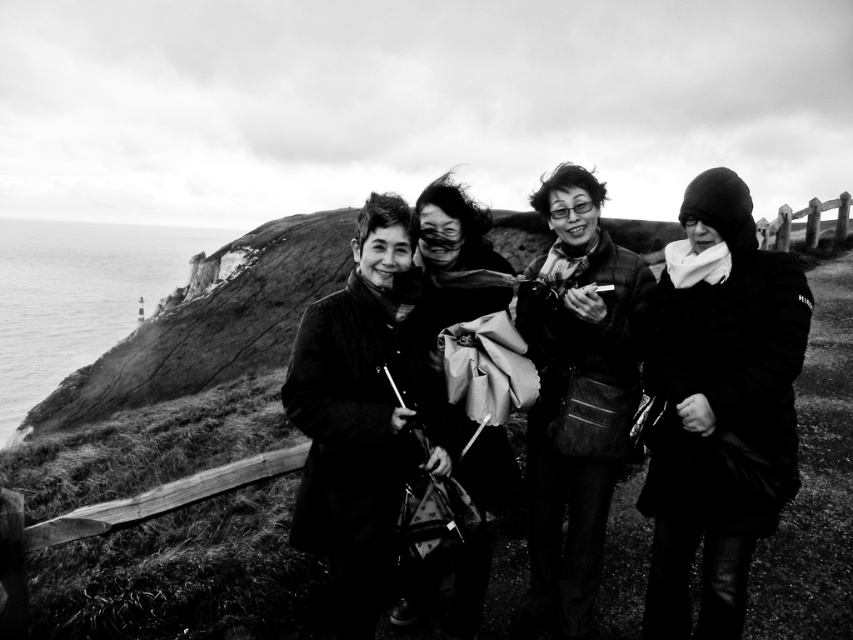
Question: Which object is positioned closest to the black woolen coat at right?

Choices:
 (A) matte black jacket at center
 (B) velvet black coat at center

Answer: (A)

Question: Estimate the real-world distances between objects in this image. Which object is closer to the matte black scarf at center?

Choices:
 (A) matte black jacket at center
 (B) black woolen coat at right
 (C) velvet black coat at center

Answer: (A)

Question: Is velvet black coat at center above matte black jacket at center?

Choices:
 (A) yes
 (B) no

Answer: (B)

Question: Which point is closer to the camera taking this photo?

Choices:
 (A) (639, 330)
 (B) (701, 621)
 (C) (474, 449)

Answer: (B)

Question: Considering the relative positions of black woolen coat at right and matte black jacket at center in the image provided, where is black woolen coat at right located with respect to matte black jacket at center?

Choices:
 (A) right
 (B) left

Answer: (A)

Question: Can you confirm if velvet black coat at center is thinner than matte black jacket at center?

Choices:
 (A) no
 (B) yes

Answer: (A)